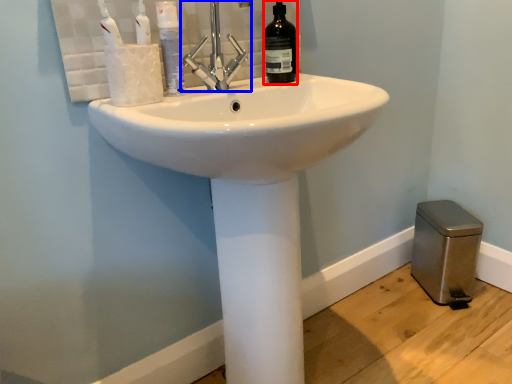
Question: Which point is further to the camera, bottle (highlighted by a red box) or tap (highlighted by a blue box)?

Choices:
 (A) bottle
 (B) tap

Answer: (A)